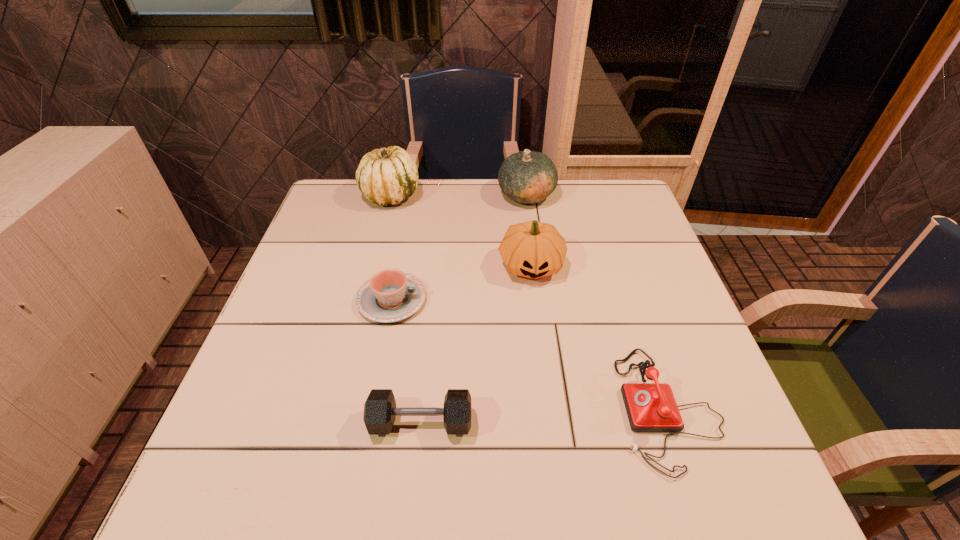
In order to click on vacant area located on the dial of the telephone in this screenshot , I will do `click(593, 408)`.

Find the location of a particular element. The width and height of the screenshot is (960, 540). vacant area situated 0.320m on the handle side of the shortest object is located at coordinates (556, 300).

Where is `object that is at the near edge`? The width and height of the screenshot is (960, 540). object that is at the near edge is located at coordinates (651, 407).

I want to click on object located in the left edge section of the desktop, so click(387, 176).

Locate an element on the screen. The image size is (960, 540). object that is at the right edge is located at coordinates (651, 407).

At what (x,y) coordinates should I click in order to perform the action: click on object that is at the far left corner. Please return your answer as a coordinate pair (x, y). This screenshot has width=960, height=540. Looking at the image, I should click on (387, 176).

At what (x,y) coordinates should I click in order to perform the action: click on object present at the near right corner. Please return your answer as a coordinate pair (x, y). This screenshot has height=540, width=960. Looking at the image, I should click on (651, 407).

Where is `free space at the far edge`? Image resolution: width=960 pixels, height=540 pixels. free space at the far edge is located at coordinates (568, 197).

Image resolution: width=960 pixels, height=540 pixels. Find the location of `vacant space at the left edge of the desktop`. vacant space at the left edge of the desktop is located at coordinates (287, 452).

This screenshot has height=540, width=960. Find the location of `vacant space at the right edge of the desktop`. vacant space at the right edge of the desktop is located at coordinates (616, 258).